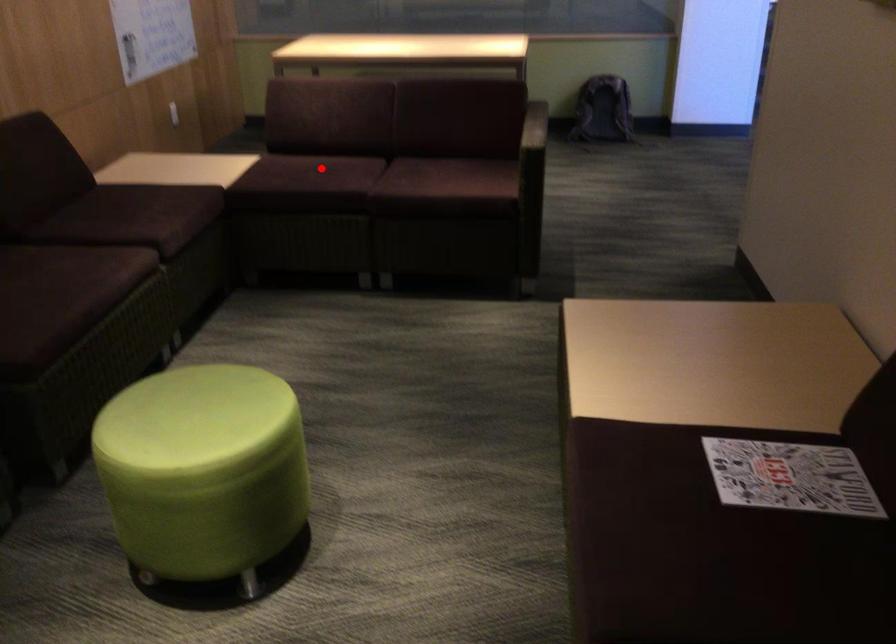
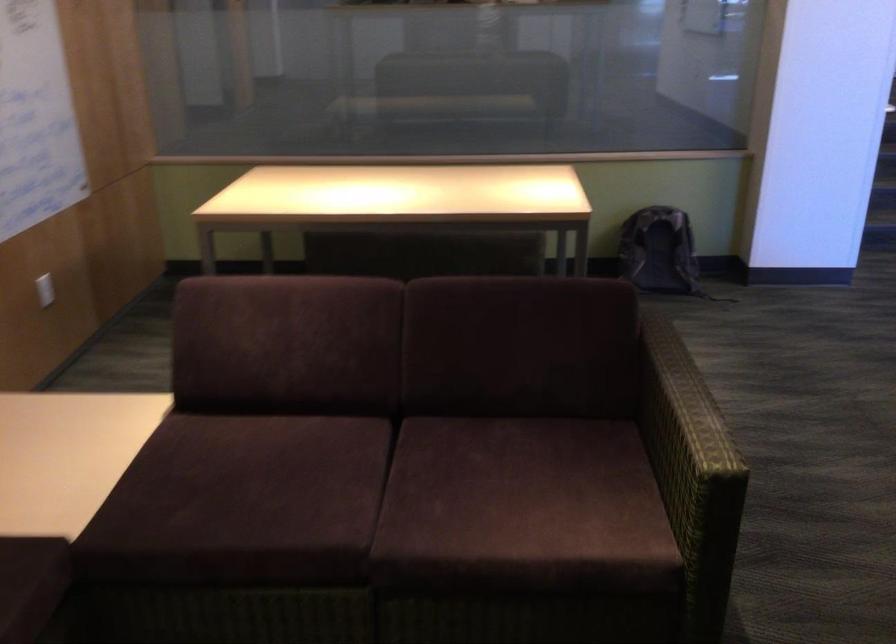
Locate, in the second image, the point that corresponds to the highlighted location in the first image.

(269, 476)